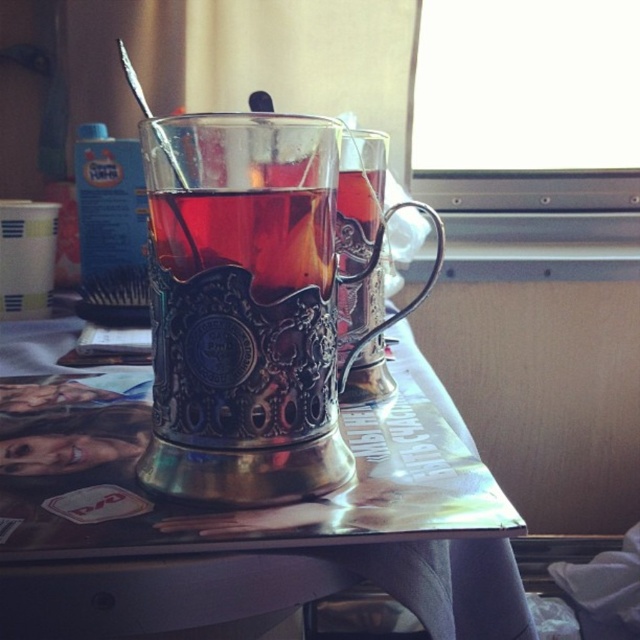
You are a barista trying to place a new mug on the table. The new mug is exactly the same size as the shiny metallic mug at center. Will it fit on the metallic brass table at center without overhanging the edges?

The shiny metallic mug at center is narrower than the metallic brass table at center, so a new mug of the same size will fit without overhanging the edges.

You are a passenger on a train and you want to place your phone on the table. The shiny metallic mug at center is in the way. Can you slide the mug to the side without it falling off the metallic brass table at center?

The shiny metallic mug at center has a lesser height compared to metallic brass table at center, so it is shorter and might be less stable. However, sliding it carefully should be possible as long as you move it slowly and ensure it stays within the table edges.

You are a photographer trying to capture the shiny metallic mug at center in focus. The camera can only focus on objects within 12 inches. Will the mug be in focus?

The shiny metallic mug at center is 13.92 inches from the camera, which is beyond the camera focus range of 12 inches. Therefore, the mug will not be in focus.